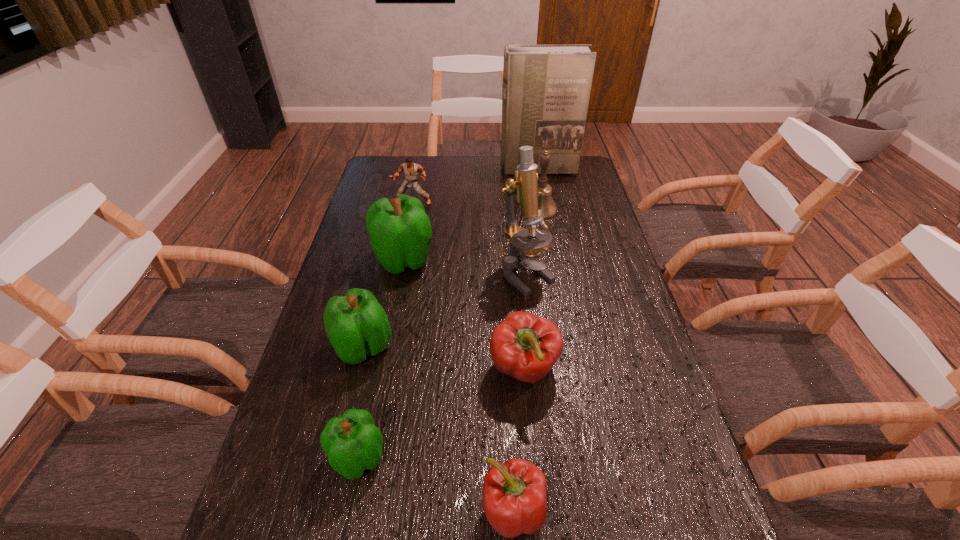
You are a GUI agent. You are given a task and a screenshot of the screen. Output one action in this format:
    pyautogui.click(x=<x>, y=<y>)
    Task: Click on the vacant point located 0.170m on the back of the microscope
    
    Given the screenshot: What is the action you would take?
    (x=520, y=224)

Identify the location of vacant space located 0.290m on the left of the bell. (442, 210).

Where is `vacant space located on the back of the farthest green bell pepper`? The width and height of the screenshot is (960, 540). vacant space located on the back of the farthest green bell pepper is located at coordinates point(418,187).

Image resolution: width=960 pixels, height=540 pixels. In order to click on vacant space located 0.400m on the front-facing side of the puncher in this screenshot , I will do `click(396, 288)`.

At what (x,y) coordinates should I click in order to perform the action: click on vacant space located 0.050m on the left of the second nearest green bell pepper. Please return your answer as a coordinate pair (x, y). This screenshot has width=960, height=540. Looking at the image, I should click on (313, 347).

Locate an element on the screen. This screenshot has width=960, height=540. vacant region located on the left of the farther pink bell pepper is located at coordinates (412, 369).

Locate an element on the screen. The height and width of the screenshot is (540, 960). vacant point located on the right of the smallest green bell pepper is located at coordinates (425, 457).

The image size is (960, 540). Identify the location of object that is positioned at the far edge. point(546,88).

Identify the location of puncher that is at the left edge. (411, 170).

I want to click on phonebook positioned at the right edge, so click(x=546, y=88).